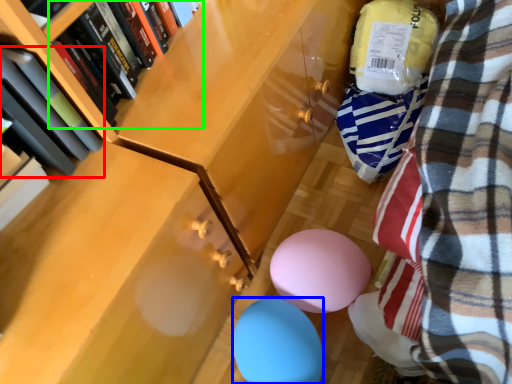
Question: Which is farther away from book (highlighted by a red box)? balloon (highlighted by a blue box) or book (highlighted by a green box)?

Choices:
 (A) balloon
 (B) book

Answer: (A)